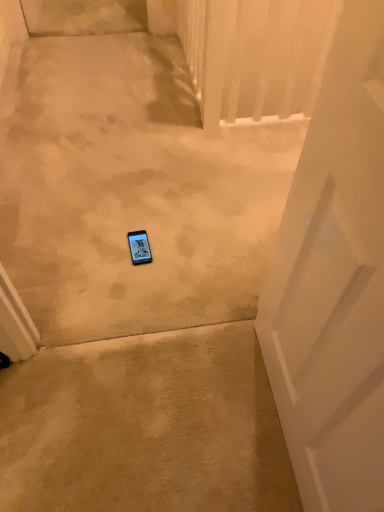
Question: Should I look upward or downward to see white matte door at center?

Choices:
 (A) down
 (B) up

Answer: (A)

Question: From the image's perspective, is white matte door at center on matte black phone at center?

Choices:
 (A) yes
 (B) no

Answer: (B)

Question: Is white matte door at center next to matte black phone at center?

Choices:
 (A) no
 (B) yes

Answer: (A)

Question: Is white matte door at center smaller than matte black phone at center?

Choices:
 (A) no
 (B) yes

Answer: (A)

Question: Does white matte door at center lie behind matte black phone at center?

Choices:
 (A) no
 (B) yes

Answer: (A)

Question: Is white matte door at center thinner than matte black phone at center?

Choices:
 (A) yes
 (B) no

Answer: (A)

Question: From a real-world perspective, is white matte door at center physically above matte black phone at center?

Choices:
 (A) yes
 (B) no

Answer: (A)

Question: Is matte black phone at center outside of white matte door at center?

Choices:
 (A) no
 (B) yes

Answer: (B)

Question: From the image's perspective, is matte black phone at center on top of white matte door at center?

Choices:
 (A) yes
 (B) no

Answer: (A)

Question: Would you consider matte black phone at center to be distant from white matte door at center?

Choices:
 (A) yes
 (B) no

Answer: (B)

Question: Is the position of matte black phone at center more distant than that of white matte door at center?

Choices:
 (A) yes
 (B) no

Answer: (A)

Question: From a real-world perspective, is matte black phone at center below white matte door at center?

Choices:
 (A) yes
 (B) no

Answer: (A)

Question: Is matte black phone at center at the left side of white matte door at center?

Choices:
 (A) no
 (B) yes

Answer: (B)

Question: Relative to matte black phone at center, is white matte door at center in front or behind?

Choices:
 (A) behind
 (B) front

Answer: (B)